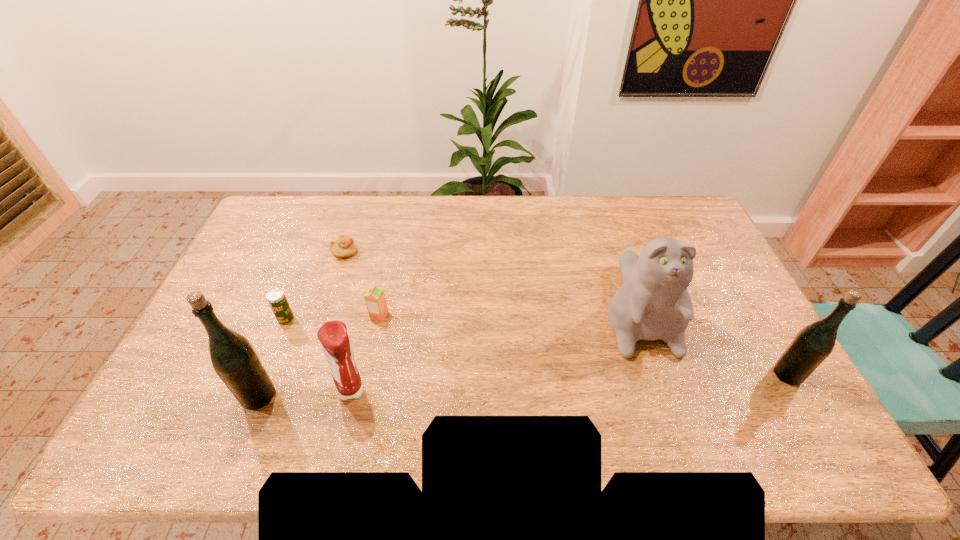
Where is `the taller beer bottle`? the taller beer bottle is located at coordinates (234, 359).

Find the location of `the left beer bottle`. the left beer bottle is located at coordinates (234, 359).

Find the location of a particular element. The image size is (960, 540). the shorter beer bottle is located at coordinates (814, 343).

Identify the location of the right beer bottle. This screenshot has width=960, height=540. (814, 343).

Where is `duckling`? The width and height of the screenshot is (960, 540). duckling is located at coordinates (344, 246).

At what (x,y) coordinates should I click in order to perform the action: click on the shortest object. Please return your answer as a coordinate pair (x, y). Image resolution: width=960 pixels, height=540 pixels. Looking at the image, I should click on (344, 246).

Locate an element on the screen. Image resolution: width=960 pixels, height=540 pixels. the sixth object from left to right is located at coordinates (653, 303).

Locate an element on the screen. orange juice is located at coordinates (375, 299).

Locate an element on the screen. The height and width of the screenshot is (540, 960). beer can is located at coordinates (276, 298).

Where is `the fourth shortest object`? the fourth shortest object is located at coordinates (333, 336).